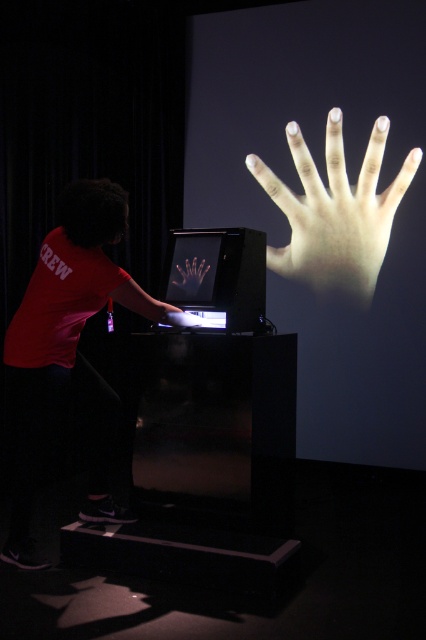
You are an attendee at this event and want to take a photo of the smooth skin hand at center and the matte red shirt at left. Which object should you zoom in on to capture both in the frame without moving the camera?

You should zoom in on the smooth skin hand at center because the matte red shirt at left is bigger than smooth skin hand at center, so focusing on the smaller object allows both to fit in the frame.

You are an attendee at this event and want to take a photo of both the smooth skin hand at center and the translucent plastic hand at center without any obstruction. Which hand should you position closer to the camera to ensure both are visible clearly?

To ensure both the smooth skin hand at center and the translucent plastic hand at center are visible clearly without obstruction, position the smooth skin hand at center closer to the camera. Since the translucent plastic hand at center is behind the smooth skin hand at center, moving the smooth skin hand forward will prevent it from blocking the view of the translucent one.

You are a guest at the exhibition and want to take a photo of the translucent plastic hand at center without the matte red shirt at left appearing in the frame. Is this possible given their positions?

The matte red shirt at left is closer to the viewer than the translucent plastic hand at center, so it would block the view of the translucent plastic hand at center. Therefore, you cannot take a photo of the translucent plastic hand at center without the matte red shirt at left appearing in the frame.